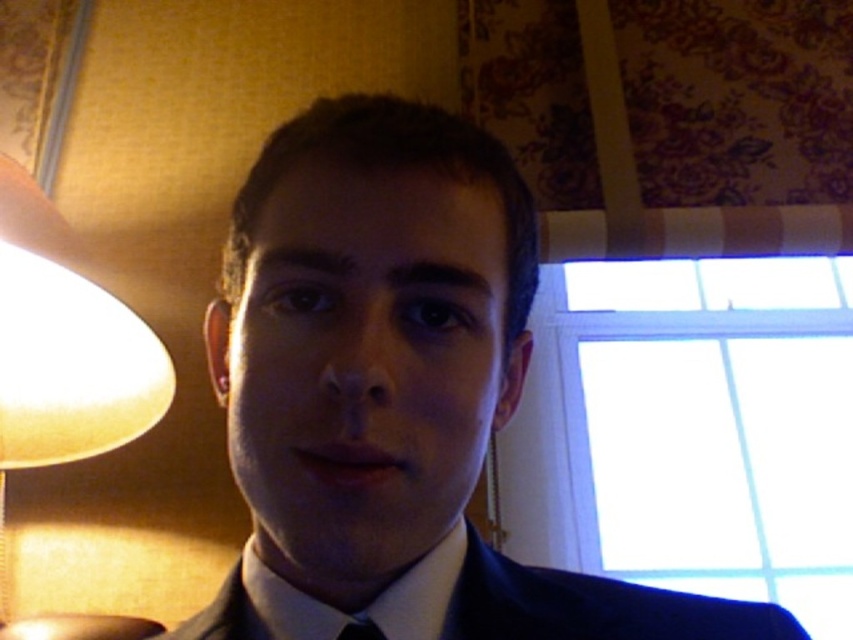
Which is behind, point (422, 600) or point (376, 625)?

Point (422, 600)

Is point (503, 326) farther from viewer compared to point (354, 634)?

That is True.

Locate an element on the screen. matte black suit at center is located at coordinates (393, 394).

Does matte beige lampshade at left come in front of black satin tie at lower center?

No, matte beige lampshade at left is behind black satin tie at lower center.

Which is behind, point (70, 417) or point (354, 621)?

The point (70, 417) is more distant.

What are the coordinates of `matte beige lampshade at left` in the screenshot? It's located at (64, 348).

Is matte black suit at center to the left of navy blue fabric business suit at center from the viewer's perspective?

Indeed, matte black suit at center is positioned on the left side of navy blue fabric business suit at center.

Who is positioned more to the left, matte black suit at center or navy blue fabric business suit at center?

matte black suit at center is more to the left.

The height and width of the screenshot is (640, 853). I want to click on matte black suit at center, so click(x=393, y=394).

Find the location of a particular element. matte black suit at center is located at coordinates (393, 394).